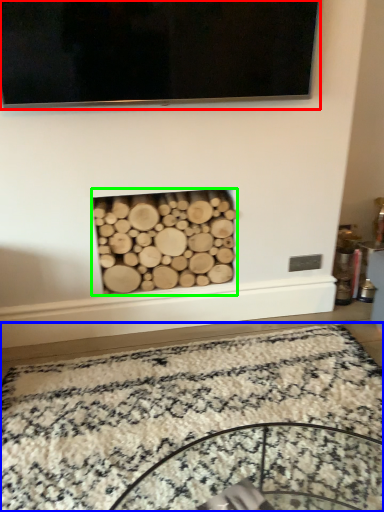
Question: Which is farther away from television (highlighted by a red box)? mat (highlighted by a blue box) or fireplace (highlighted by a green box)?

Choices:
 (A) mat
 (B) fireplace

Answer: (A)